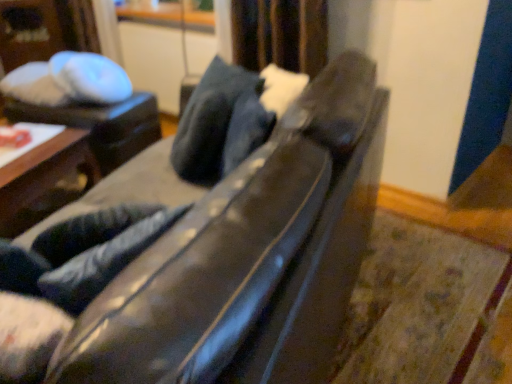
Question: Do you think white glossy table at upper left, which ranks as the 2th table in front-to-back order, is within dark blue leather pillow at center, or outside of it?

Choices:
 (A) outside
 (B) inside

Answer: (A)

Question: Considering the positions of point (157, 127) and point (186, 125), is point (157, 127) closer or farther from the camera than point (186, 125)?

Choices:
 (A) closer
 (B) farther

Answer: (B)

Question: Estimate the real-world distances between objects in this image. Which object is closer to the white glossy table at upper left, which ranks as the 2th table in front-to-back order?

Choices:
 (A) wooden table at left, which is counted as the first table, starting from the front
 (B) dark blue leather pillow at center
 (C) satin dark blue curtain at upper center
 (D) black leather couch at center

Answer: (A)

Question: Which object is the closest to the dark blue leather pillow at center?

Choices:
 (A) black leather couch at center
 (B) white glossy table at upper left, the 1th table in the back-to-front sequence
 (C) satin dark blue curtain at upper center
 (D) wooden table at left, which is counted as the first table, starting from the front

Answer: (A)